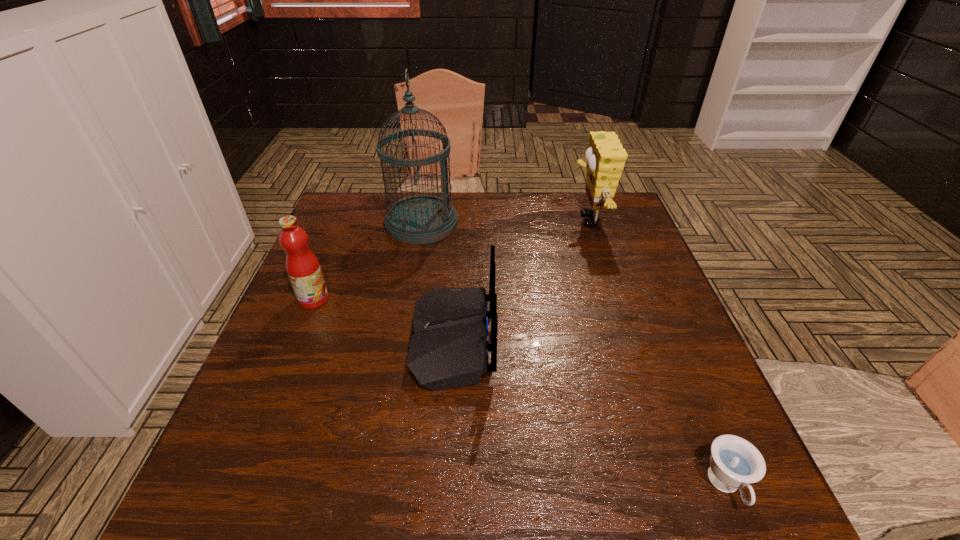
The width and height of the screenshot is (960, 540). In order to click on vacant point located between the tallest object and the router in this screenshot , I will do `click(437, 282)`.

This screenshot has height=540, width=960. What are the coordinates of `free spot between the birdcage and the fourth tallest object` in the screenshot? It's located at (437, 282).

The height and width of the screenshot is (540, 960). What are the coordinates of `free point between the birdcage and the fruit juice` in the screenshot? It's located at (368, 261).

I want to click on unoccupied position between the shortest object and the fruit juice, so [519, 393].

This screenshot has width=960, height=540. Identify the location of unoccupied area between the leftmost object and the tallest object. (368, 261).

Identify the location of free spot between the nearest object and the fruit juice. (519, 393).

Identify which object is the second nearest to the sponge. Please provide its 2D coordinates. Your answer should be formatted as a tuple, i.e. [(x, y)], where the tuple contains the x and y coordinates of a point satisfying the conditions above.

[(418, 219)]

Choose which object is the nearest neighbor to the tallest object. Please provide its 2D coordinates. Your answer should be formatted as a tuple, i.e. [(x, y)], where the tuple contains the x and y coordinates of a point satisfying the conditions above.

[(303, 268)]